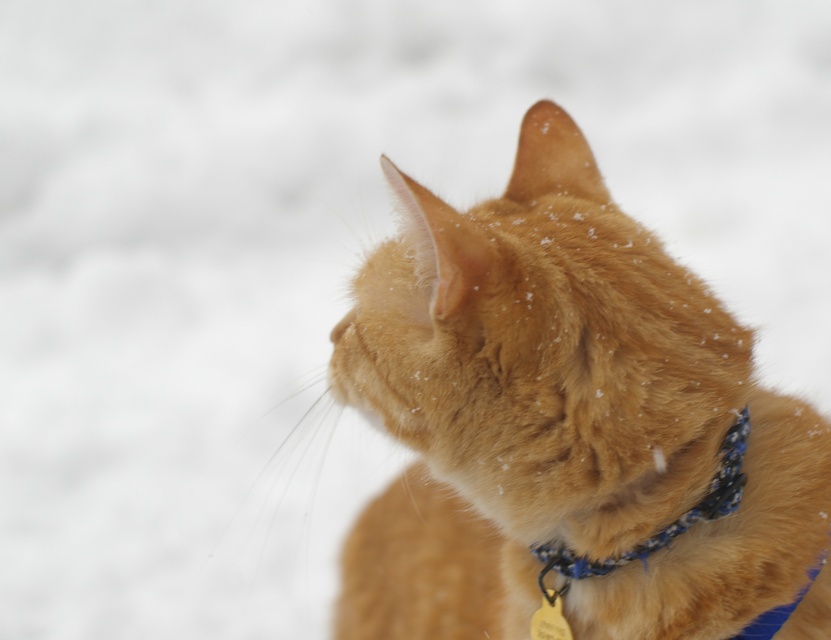
Which is more to the right, orange fur cat at center or blue fabric neckband at center?

blue fabric neckband at center

Is orange fur cat at center shorter than blue fabric neckband at center?

No.

Image resolution: width=831 pixels, height=640 pixels. In order to click on orange fur cat at center in this screenshot , I will do 569,426.